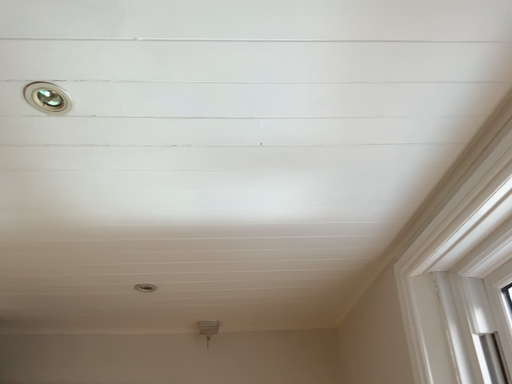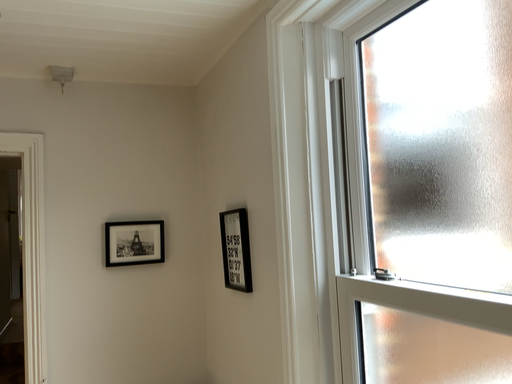
Question: How did the camera likely rotate when shooting the video?

Choices:
 (A) rotated upward
 (B) rotated downward

Answer: (B)